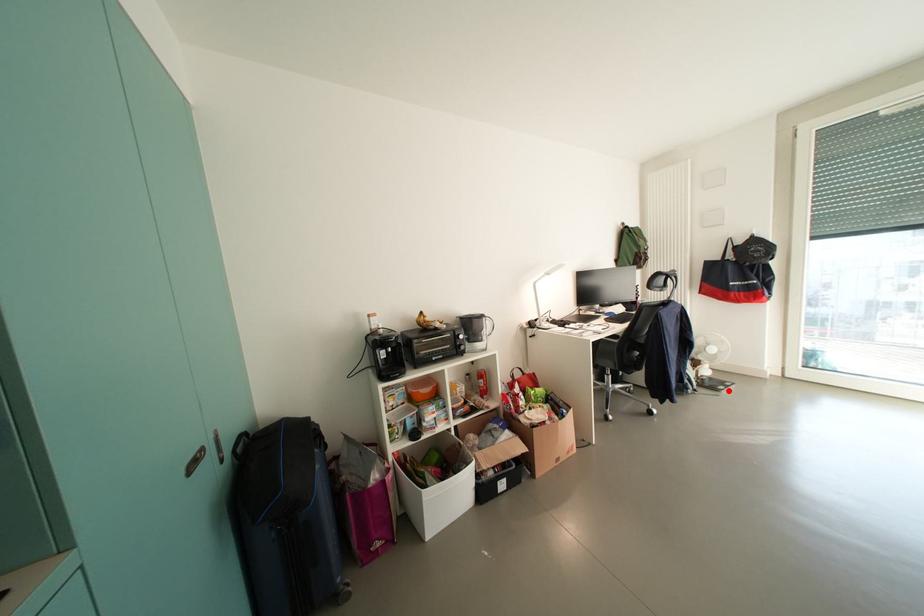
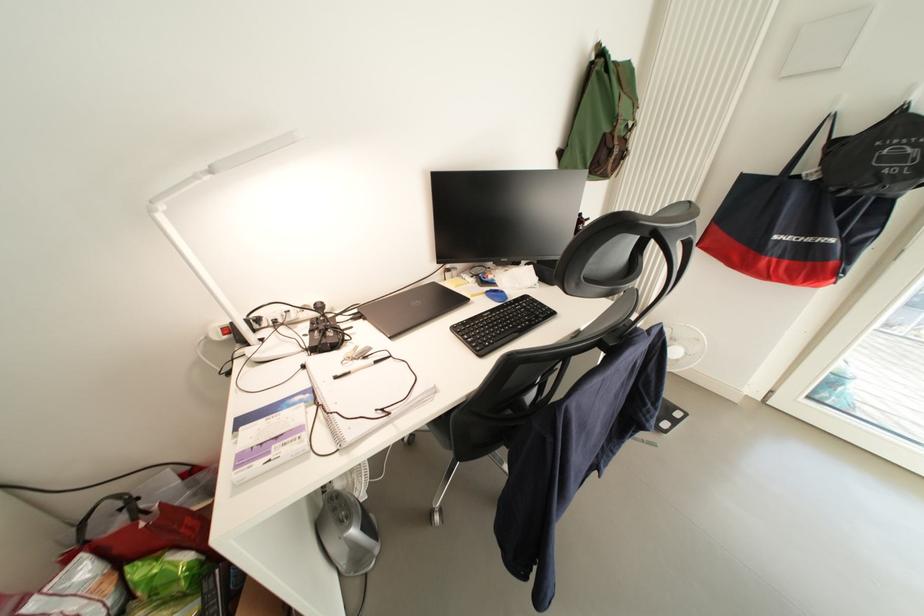
Question: I am providing you with two images of the same scene from different viewpoints. Given a red point in image1, look at the same physical point in image2. Is it:

Choices:
 (A) Closer to the viewpoint
 (B) Farther from the viewpoint

Answer: (B)